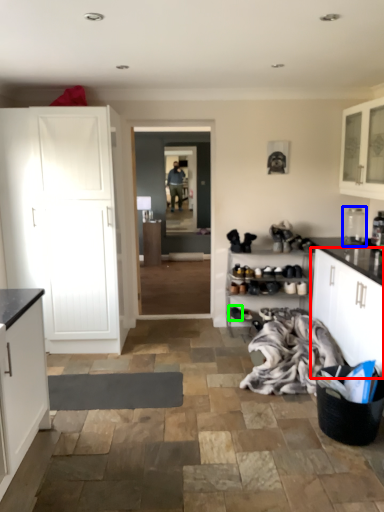
Question: Which object is the farthest from cabinetry (highlighted by a red box)? Choose among these: appliance (highlighted by a blue box) or footwear (highlighted by a green box).

Choices:
 (A) appliance
 (B) footwear

Answer: (B)